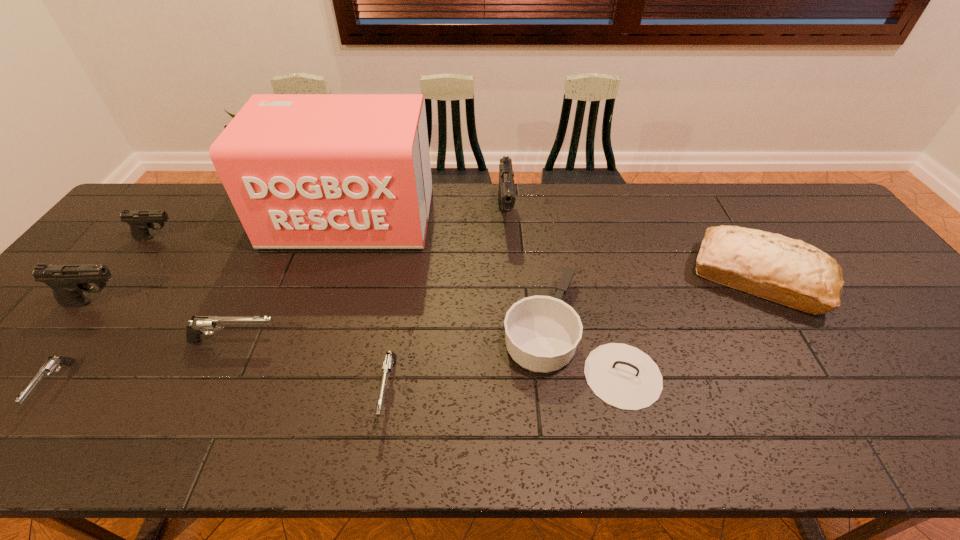
Find the location of a particular element. Image resolution: width=960 pixels, height=540 pixels. box is located at coordinates (303, 171).

The width and height of the screenshot is (960, 540). I want to click on the tallest object, so click(303, 171).

At what (x,y) coordinates should I click in order to perform the action: click on the eighth shortest object. Please return your answer as a coordinate pair (x, y). Looking at the image, I should click on tap(506, 194).

Where is `the tallest pistol`? Image resolution: width=960 pixels, height=540 pixels. the tallest pistol is located at coordinates (506, 194).

The image size is (960, 540). In order to click on the nearest black pistol in this screenshot , I will do `click(68, 282)`.

The image size is (960, 540). I want to click on the second tallest pistol, so click(68, 282).

Where is `the rightmost object`? This screenshot has height=540, width=960. the rightmost object is located at coordinates (791, 272).

This screenshot has height=540, width=960. Find the location of `the smallest black pistol`. the smallest black pistol is located at coordinates (139, 221).

Find the location of a particular element. The image size is (960, 540). the second silver pistol from right to left is located at coordinates (199, 324).

Image resolution: width=960 pixels, height=540 pixels. Find the location of `the fourth farthest pistol`. the fourth farthest pistol is located at coordinates [x=199, y=324].